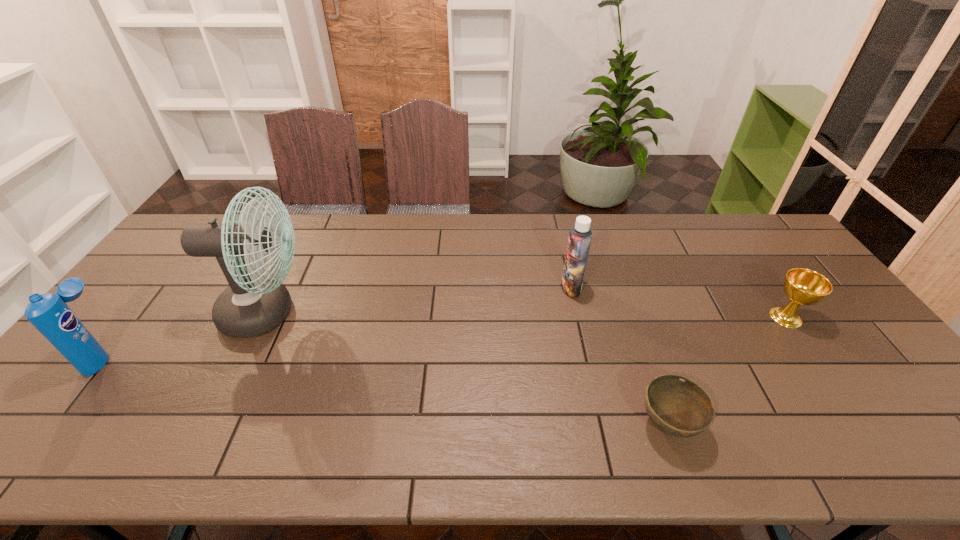
This screenshot has height=540, width=960. Find the location of `the tallest object`. the tallest object is located at coordinates (252, 305).

The width and height of the screenshot is (960, 540). I want to click on fan, so click(x=252, y=305).

I want to click on the third object from right to left, so click(580, 236).

At what (x,y) coordinates should I click in order to perform the action: click on the right shampoo. Please return your answer as a coordinate pair (x, y). This screenshot has height=540, width=960. Looking at the image, I should click on (580, 236).

Where is `the left shampoo`? The width and height of the screenshot is (960, 540). the left shampoo is located at coordinates (48, 313).

Find the location of a particular element. the nearer shampoo is located at coordinates point(48,313).

What are the coordinates of `the rightmost object` in the screenshot? It's located at (802, 286).

Identify the location of the second shortest object. (802, 286).

What are the coordinates of `the shortest object` in the screenshot? It's located at (677, 406).

Locate an element on the screen. The image size is (960, 540). bowl is located at coordinates (677, 406).